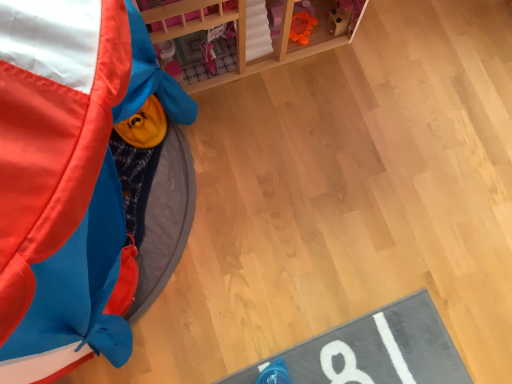
You are a GUI agent. You are given a task and a screenshot of the screen. Output one action in this format:
    pyautogui.click(x=<x>, y=<y>)
    Task: Click on the vacant space underneath rubberized yellow toy at upper left (from a real-world perspective)
    This screenshot has width=512, height=384.
    Given the screenshot: What is the action you would take?
    pyautogui.click(x=167, y=208)